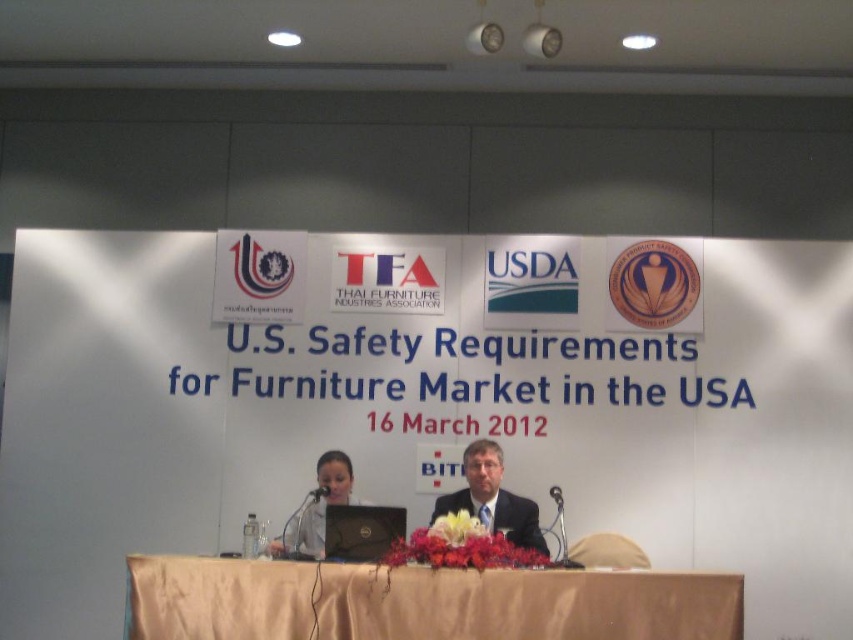
You are attending a conference about U.S. furniture safety standards and notice two points marked on the presentation screen. Which point, point (x=456, y=616) or point (x=467, y=474), is nearer to you as you sit in the audience?

Point (x=456, y=616) is closer to the viewer than point (x=467, y=474).

You are an attendee at this conference. You need to present your credentials to the person wearing the dark suit at center. However, you also have a black matte laptop at center that you need to keep on your lap. Can you comfortably present your credentials while keeping the laptop on your lap?

The dark suit at center is bigger than the black matte laptop at center, so the person in the dark suit at center has a larger physical presence. This might make it challenging to simultaneously present credentials and keep the laptop on your lap, as the laptop is smaller and may require more focus to handle while addressing someone larger in front of you.